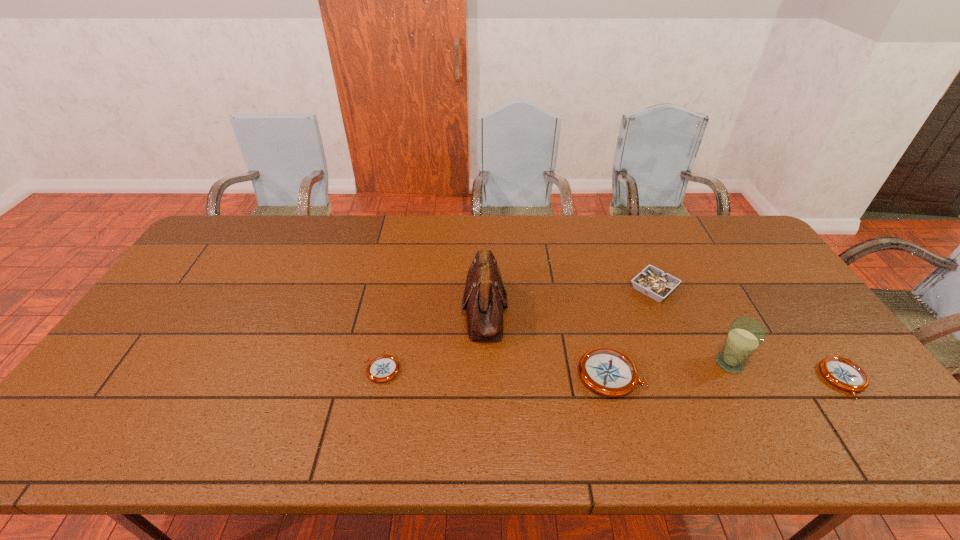
Where is `free space between the second shortest object and the shoulder bag`? The width and height of the screenshot is (960, 540). free space between the second shortest object and the shoulder bag is located at coordinates (664, 344).

Locate which object is the second closest to the ashtray. Please provide its 2D coordinates. Your answer should be formatted as a tuple, i.e. [(x, y)], where the tuple contains the x and y coordinates of a point satisfying the conditions above.

[(609, 372)]

Choose which object is the fourth nearest neighbor to the shoulder bag. Please provide its 2D coordinates. Your answer should be formatted as a tuple, i.e. [(x, y)], where the tuple contains the x and y coordinates of a point satisfying the conditions above.

[(745, 335)]

The height and width of the screenshot is (540, 960). Identify the location of compass that is the closest to the fourth object from right to left. (841, 372).

Image resolution: width=960 pixels, height=540 pixels. I want to click on compass identified as the closest to the fifth shortest object, so click(841, 372).